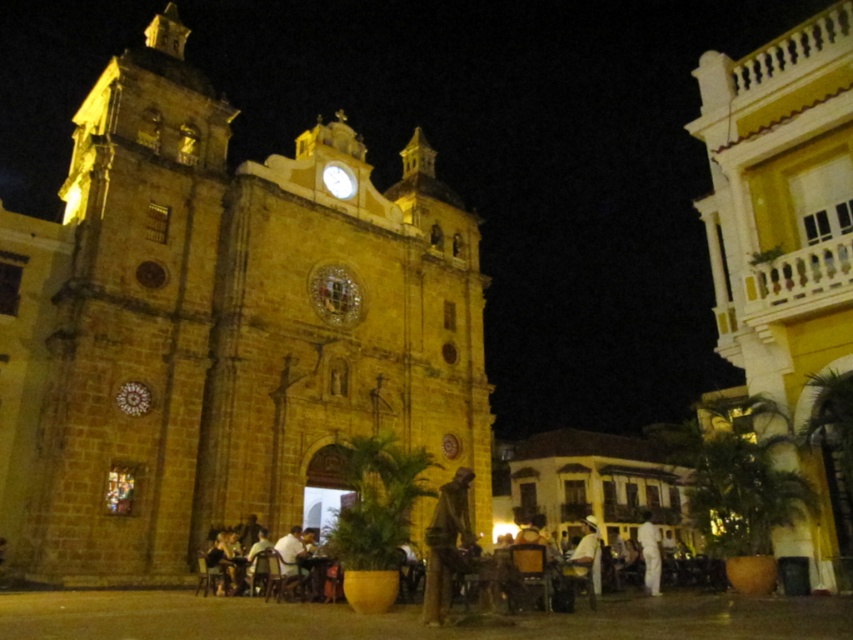
Which is above, yellow stucco church at center or white fabric shirt at lower right?

yellow stucco church at center is above.

Who is positioned more to the left, yellow stucco church at center or white fabric shirt at lower right?

white fabric shirt at lower right

Who is more distant from viewer, (842, 38) or (584, 545)?

Positioned behind is point (584, 545).

Identify the location of yellow stucco church at center. (781, 205).

Is white fabric shirt at lower right thinner than white cotton pants at lower right?

Indeed, white fabric shirt at lower right has a lesser width compared to white cotton pants at lower right.

Is point (595, 588) more distant than point (653, 595)?

No.

Locate an element on the screen. white fabric shirt at lower right is located at coordinates (587, 556).

Can you confirm if golden stone church at center is bigger than yellow stucco church at center?

Incorrect, golden stone church at center is not larger than yellow stucco church at center.

Which is behind, point (451, 260) or point (763, 204)?

Point (451, 260)

Identify the location of golden stone church at center. The height and width of the screenshot is (640, 853). (219, 328).